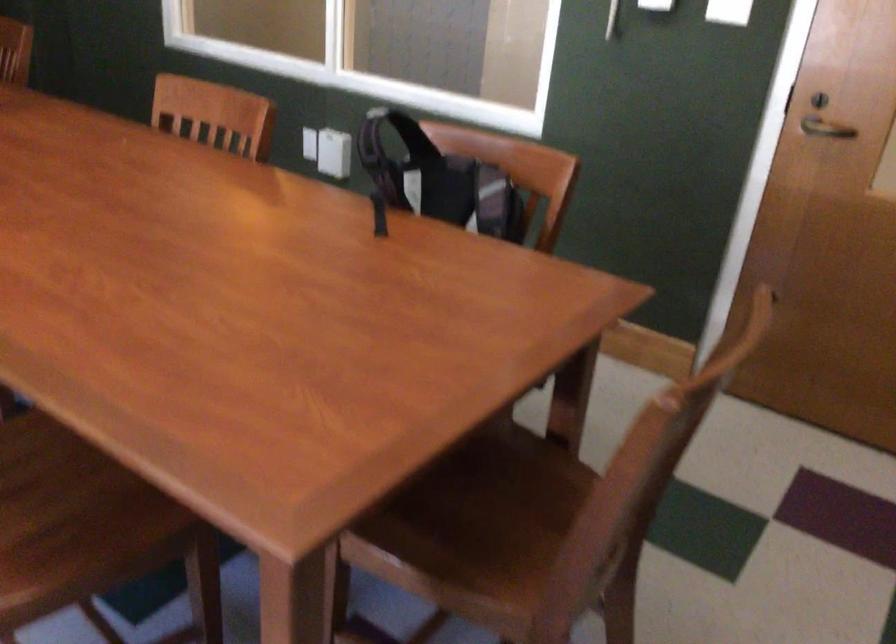
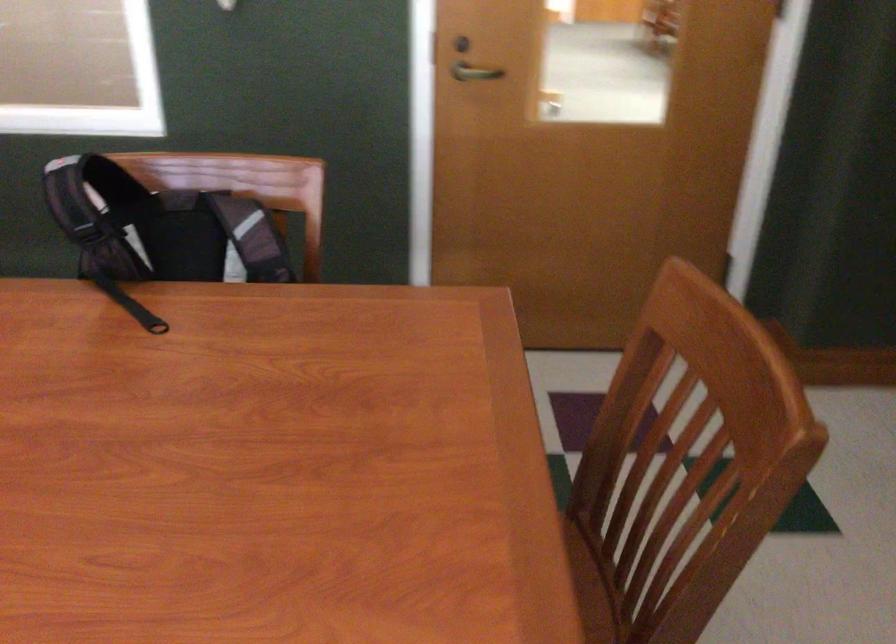
Locate, in the second image, the point that corresponds to pixel 435 178 in the first image.

(159, 228)